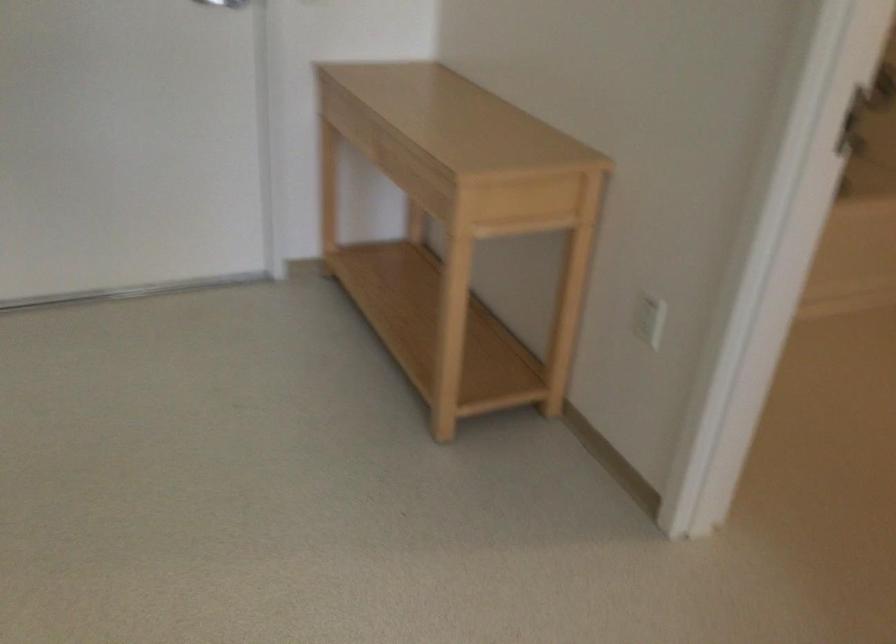
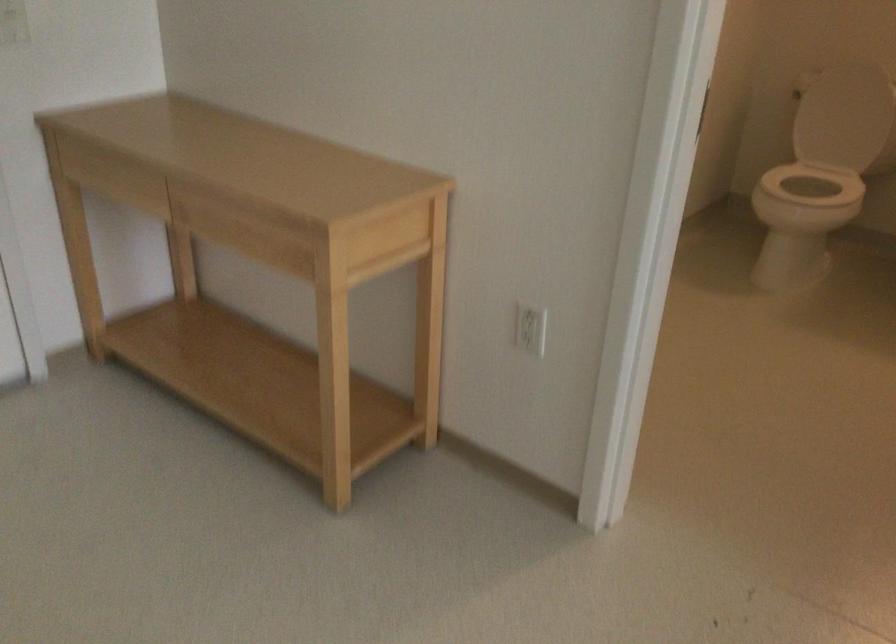
Question: The camera is either moving clockwise (left) or counter-clockwise (right) around the object. The first image is from the beginning of the video and the second image is from the end. Is the camera moving left or right when shooting the video?

Choices:
 (A) Left
 (B) Right

Answer: (A)